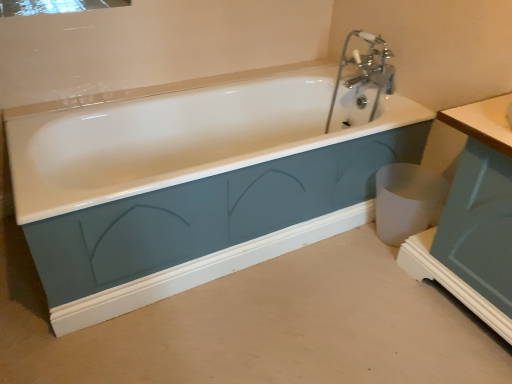
I want to click on vacant space that's between white glossy bathtub at center and white matte trash can at lower right, so click(286, 269).